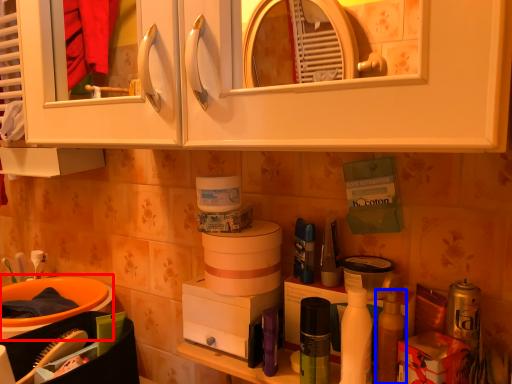
Question: Which object is closer to the camera taking this photo, sink (highlighted by a red box) or mouthwash (highlighted by a blue box)?

Choices:
 (A) sink
 (B) mouthwash

Answer: (B)